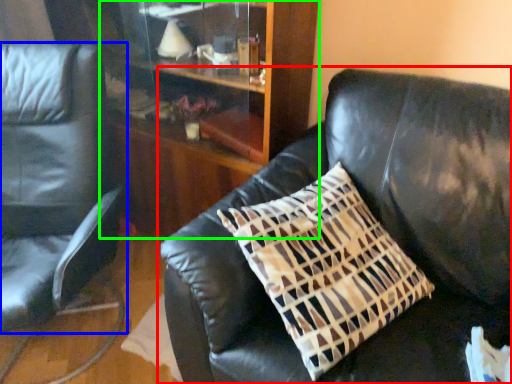
Question: Estimate the real-world distances between objects in this image. Which object is closer to studio couch (highlighted by a red box), chair (highlighted by a blue box) or dresser (highlighted by a green box)?

Choices:
 (A) chair
 (B) dresser

Answer: (B)